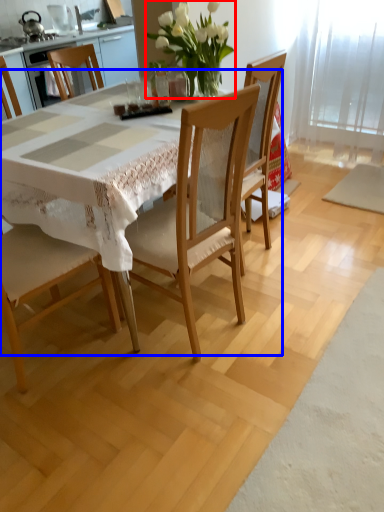
Question: Which object is closer to the camera taking this photo, floral arrangement (highlighted by a red box) or round table (highlighted by a blue box)?

Choices:
 (A) floral arrangement
 (B) round table

Answer: (B)